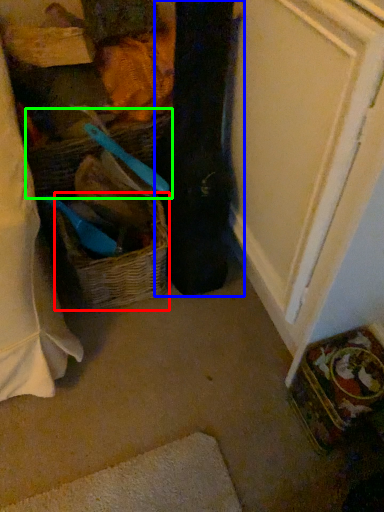
Question: Based on their relative distances, which object is farther from picnic basket (highlighted by a red box)? Choose from clothing (highlighted by a blue box) and basket (highlighted by a green box).

Choices:
 (A) clothing
 (B) basket

Answer: (B)